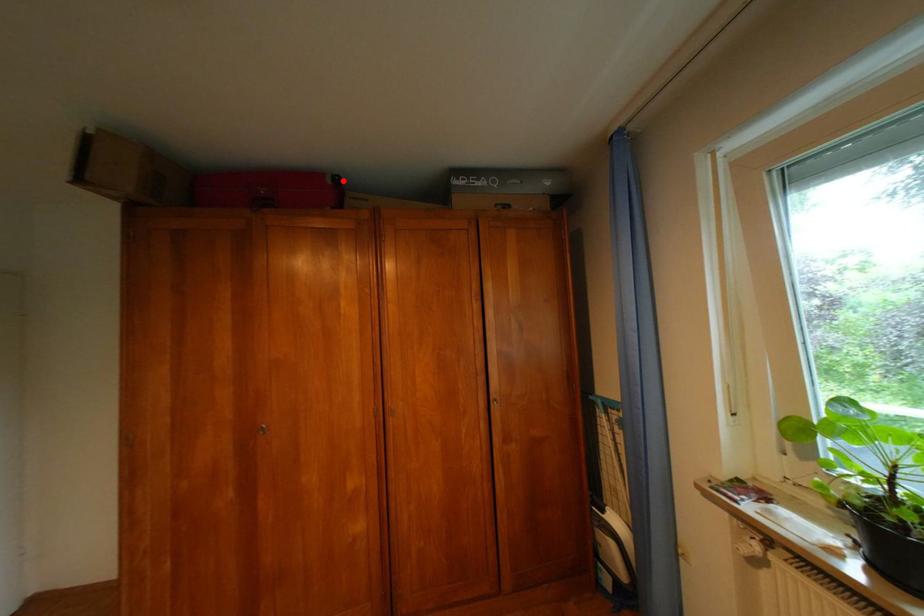
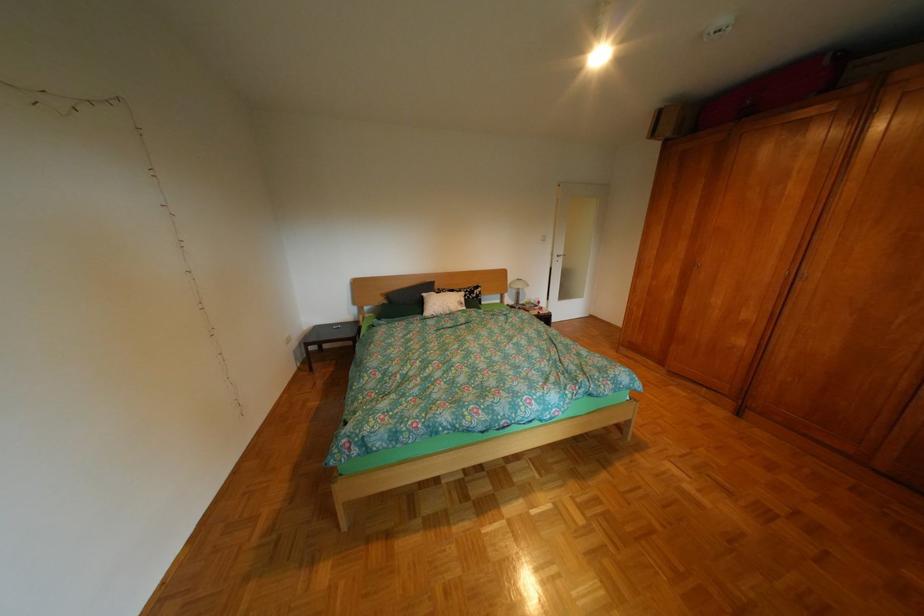
Where in the second image is the point corresponding to the highlighted location from the first image?

(842, 63)